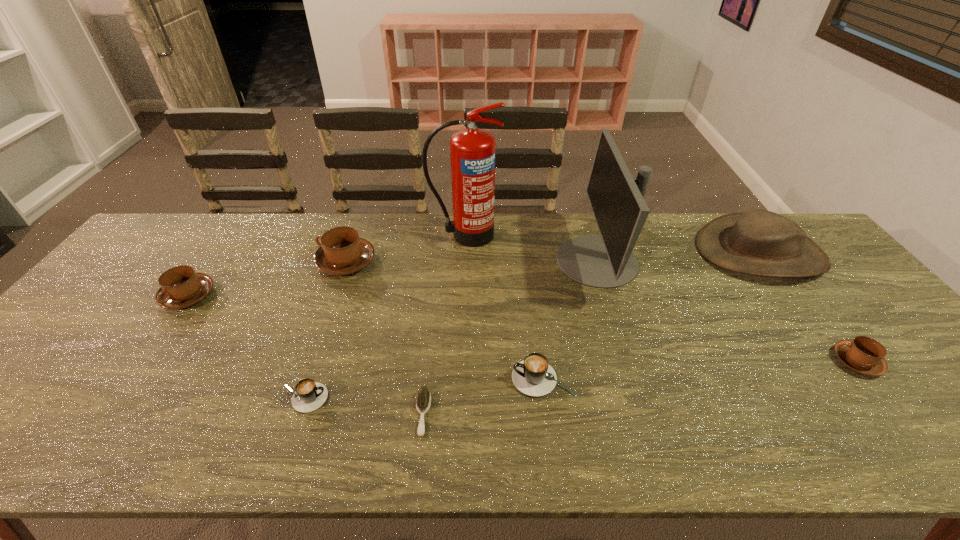
The width and height of the screenshot is (960, 540). I want to click on the tallest object, so click(x=472, y=151).

Identify the location of fire extinguisher. (472, 151).

This screenshot has width=960, height=540. Identify the location of the third object from right to left. (617, 200).

The image size is (960, 540). In order to click on the second tallest object in this screenshot , I will do `click(617, 200)`.

This screenshot has height=540, width=960. I want to click on the third tallest object, so click(x=758, y=242).

Find the location of a particular element. cowboy hat is located at coordinates (758, 242).

You are a GUI agent. You are given a task and a screenshot of the screen. Output one action in this format:
    pyautogui.click(x=<x>, y=<y>)
    Task: Click on the second brown cappuccino from left to right
    Image resolution: width=960 pixels, height=540 pixels.
    Given the screenshot: What is the action you would take?
    pyautogui.click(x=342, y=252)

Find the location of a particular element. The image size is (960, 540). the sixth shortest object is located at coordinates (342, 252).

Find the location of `the fifth tallest object`. the fifth tallest object is located at coordinates (181, 287).

At what (x,y) coordinates should I click in order to perform the action: click on the leftmost cappuccino. Please return your answer as a coordinate pair (x, y). The height and width of the screenshot is (540, 960). Looking at the image, I should click on (181, 287).